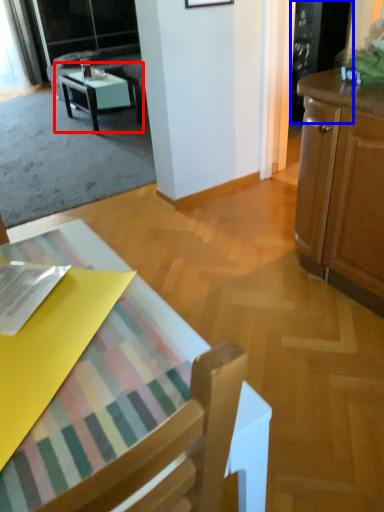
Question: Which object is closer to the camera taking this photo, table (highlighted by a red box) or screen door (highlighted by a blue box)?

Choices:
 (A) table
 (B) screen door

Answer: (B)